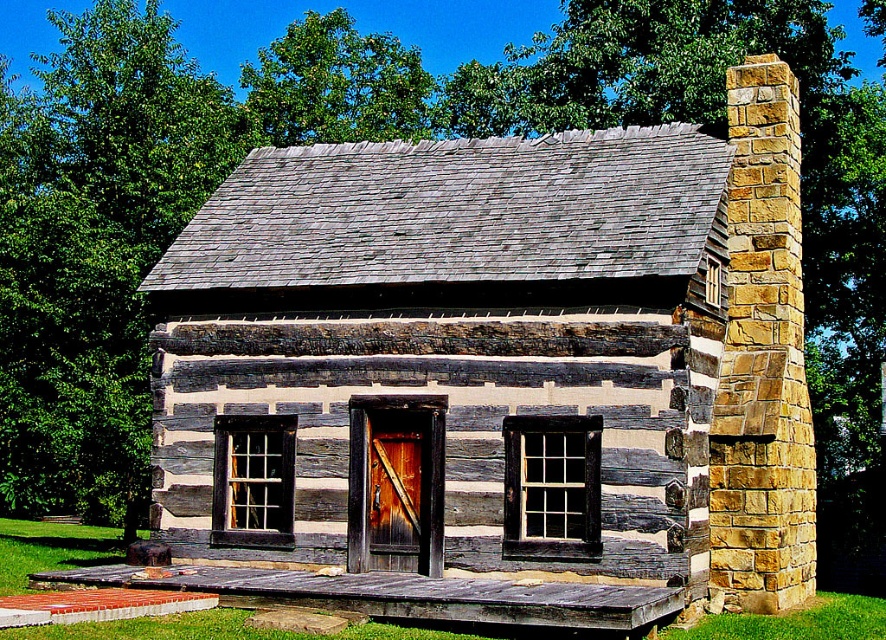
Which of these two, weathered wood cabin at center or brown wooden door at center, stands shorter?

brown wooden door at center

Which is in front, point (387, 145) or point (426, 412)?

Positioned in front is point (426, 412).

The height and width of the screenshot is (640, 886). In order to click on weathered wood cabin at center in this screenshot , I will do `click(499, 369)`.